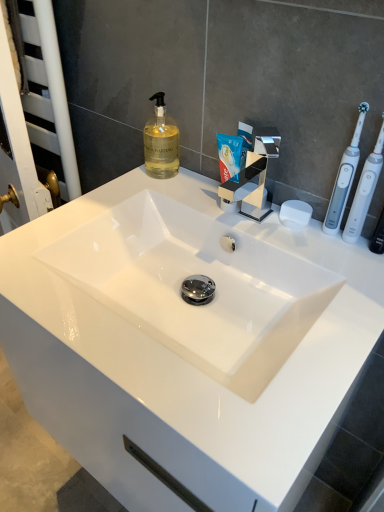
Question: Considering the relative sizes of white plastic toothbrush at right, positioned as the second toothbrush in left-to-right order, and white plastic toothbrush at right, the 2th toothbrush in the right-to-left sequence, in the image provided, is white plastic toothbrush at right, positioned as the second toothbrush in left-to-right order, thinner than white plastic toothbrush at right, the 2th toothbrush in the right-to-left sequence,?

Choices:
 (A) yes
 (B) no

Answer: (B)

Question: Considering the relative positions of white plastic toothbrush at right, positioned as the second toothbrush in left-to-right order, and white plastic toothbrush at right, the 1th toothbrush when ordered from left to right, in the image provided, is white plastic toothbrush at right, positioned as the second toothbrush in left-to-right order, in front of white plastic toothbrush at right, the 1th toothbrush when ordered from left to right,?

Choices:
 (A) no
 (B) yes

Answer: (B)

Question: Can you confirm if white plastic toothbrush at right, the first toothbrush when ordered from right to left, is smaller than white plastic toothbrush at right, the 2th toothbrush in the right-to-left sequence?

Choices:
 (A) yes
 (B) no

Answer: (A)

Question: From a real-world perspective, does white plastic toothbrush at right, the first toothbrush when ordered from right to left, stand above white plastic toothbrush at right, the 2th toothbrush in the right-to-left sequence?

Choices:
 (A) no
 (B) yes

Answer: (A)

Question: Does white plastic toothbrush at right, the first toothbrush when ordered from right to left, have a greater width compared to white plastic toothbrush at right, the 2th toothbrush in the right-to-left sequence?

Choices:
 (A) no
 (B) yes

Answer: (B)

Question: Considering the positions of point (172, 174) and point (74, 276), is point (172, 174) closer or farther from the camera than point (74, 276)?

Choices:
 (A) closer
 (B) farther

Answer: (B)

Question: Is translucent glass soap dispenser at upper center to the left or to the right of white glossy sink at center in the image?

Choices:
 (A) right
 (B) left

Answer: (B)

Question: Considering the positions of translucent glass soap dispenser at upper center and white glossy sink at center in the image, is translucent glass soap dispenser at upper center taller or shorter than white glossy sink at center?

Choices:
 (A) short
 (B) tall

Answer: (B)

Question: Based on their sizes in the image, would you say translucent glass soap dispenser at upper center is bigger or smaller than white glossy sink at center?

Choices:
 (A) small
 (B) big

Answer: (A)

Question: Considering the relative positions of translucent glass soap dispenser at upper center and white plastic toothbrush at right, the 1th toothbrush when ordered from left to right, in the image provided, is translucent glass soap dispenser at upper center to the left or to the right of white plastic toothbrush at right, the 1th toothbrush when ordered from left to right,?

Choices:
 (A) left
 (B) right

Answer: (A)

Question: Looking at their shapes, would you say translucent glass soap dispenser at upper center is wider or thinner than white plastic toothbrush at right, the 2th toothbrush in the right-to-left sequence?

Choices:
 (A) wide
 (B) thin

Answer: (A)

Question: Does point (147, 163) appear closer or farther from the camera than point (331, 219)?

Choices:
 (A) closer
 (B) farther

Answer: (B)

Question: Considering the positions of translucent glass soap dispenser at upper center and white plastic toothbrush at right, the 2th toothbrush in the right-to-left sequence, in the image, is translucent glass soap dispenser at upper center bigger or smaller than white plastic toothbrush at right, the 2th toothbrush in the right-to-left sequence,?

Choices:
 (A) big
 (B) small

Answer: (A)

Question: Does point (261, 317) appear closer or farther from the camera than point (347, 227)?

Choices:
 (A) farther
 (B) closer

Answer: (B)

Question: From a real-world perspective, is white glossy sink at center physically located above or below white plastic toothbrush at right, positioned as the second toothbrush in left-to-right order?

Choices:
 (A) above
 (B) below

Answer: (B)